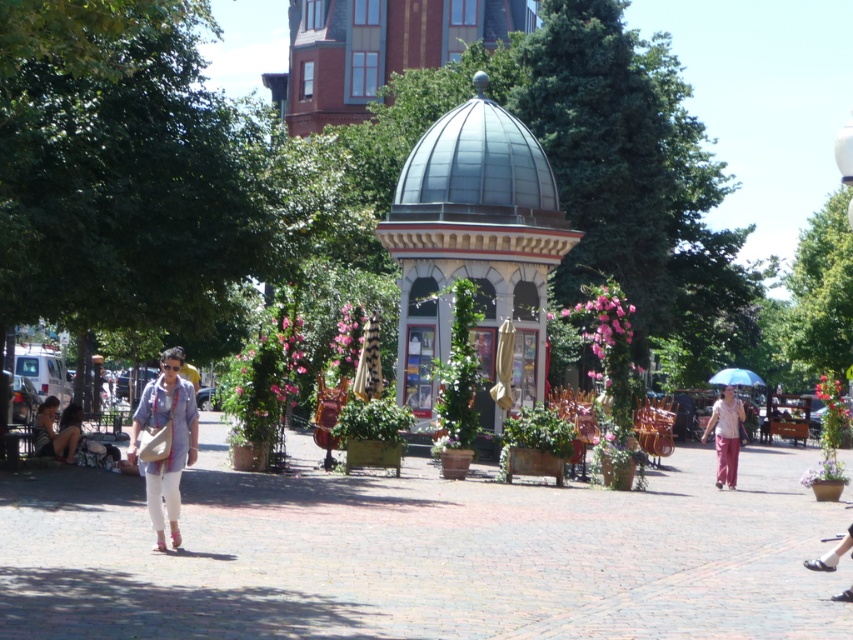
Which of these two, green leafy tree at left or green leafy tree at center, stands taller?

With more height is green leafy tree at center.

Does point (189, 236) come closer to viewer compared to point (740, 282)?

Yes.

Where is `green leafy tree at left`? The width and height of the screenshot is (853, 640). green leafy tree at left is located at coordinates (120, 170).

Is green leafy tree at left shorter than matte white pants at center-left?

No, green leafy tree at left is not shorter than matte white pants at center-left.

Between point (28, 99) and point (140, 465), which one is positioned behind?

The point (28, 99) is more distant.

You are a GUI agent. You are given a task and a screenshot of the screen. Output one action in this format:
    pyautogui.click(x=<x>, y=<y>)
    Task: Click on the green leafy tree at left
    The width and height of the screenshot is (853, 640).
    Given the screenshot: What is the action you would take?
    pyautogui.click(x=120, y=170)

Is point (183, 80) positioned behind point (738, 419)?

No, it is in front of (738, 419).

Can you confirm if green leafy tree at left is bigger than pink fabric umbrella at right?

Correct, green leafy tree at left is larger in size than pink fabric umbrella at right.

Between point (90, 106) and point (729, 412), which one is positioned behind?

Positioned behind is point (729, 412).

I want to click on green leafy tree at left, so click(120, 170).